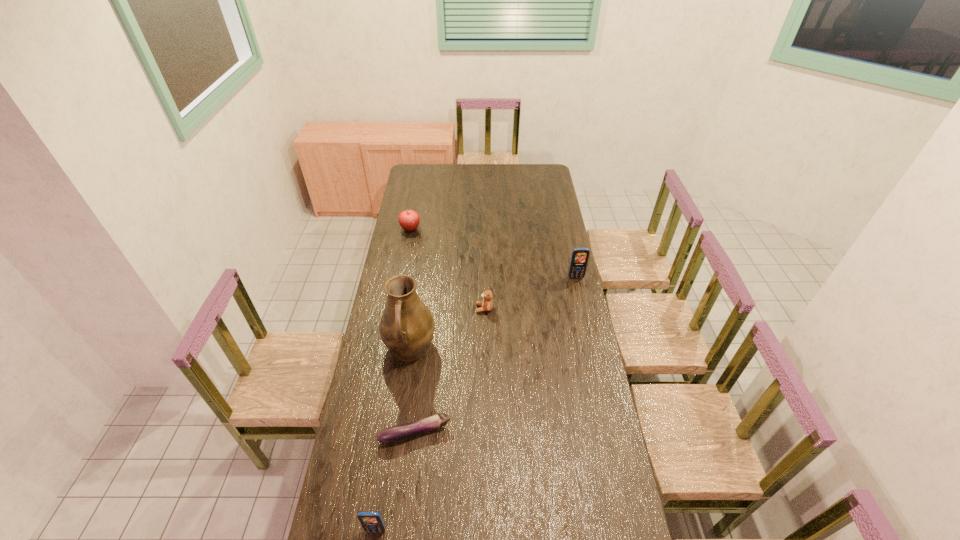
Find the location of a particular element. The height and width of the screenshot is (540, 960). the nearer cellular telephone is located at coordinates (371, 521).

The width and height of the screenshot is (960, 540). I want to click on the nearest object, so click(371, 521).

Find the location of `the farther cellular telephone`. the farther cellular telephone is located at coordinates (580, 256).

The image size is (960, 540). I want to click on the rightmost object, so click(580, 256).

Locate an element on the screen. The height and width of the screenshot is (540, 960). the farthest object is located at coordinates (409, 220).

This screenshot has width=960, height=540. I want to click on the fourth farthest object, so click(x=407, y=326).

At what (x,y) coordinates should I click in order to perform the action: click on the tallest object. Please return your answer as a coordinate pair (x, y). Looking at the image, I should click on (407, 326).

At what (x,y) coordinates should I click in order to perform the action: click on the shortest object. Please return your answer as a coordinate pair (x, y). Image resolution: width=960 pixels, height=540 pixels. Looking at the image, I should click on (396, 433).

At what (x,y) coordinates should I click in order to perform the action: click on the second nearest object. Please return your answer as a coordinate pair (x, y). Looking at the image, I should click on (396, 433).

The image size is (960, 540). I want to click on the third farthest object, so click(x=487, y=304).